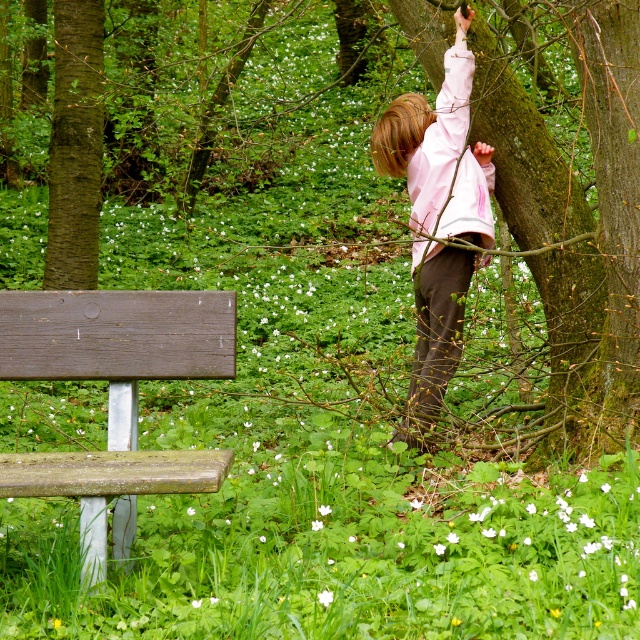
Question: Does wooden bench at lower left have a lesser width compared to pink fabric shirt at upper right?

Choices:
 (A) yes
 (B) no

Answer: (B)

Question: Among these objects, which one is nearest to the camera?

Choices:
 (A) pink fabric shirt at upper right
 (B) wooden bench at lower left

Answer: (B)

Question: Is the position of smooth bark tree at upper right more distant than that of wooden bench at lower left?

Choices:
 (A) yes
 (B) no

Answer: (A)

Question: Which object is farther from the camera taking this photo?

Choices:
 (A) smooth bark tree at upper right
 (B) wooden bench at lower left

Answer: (A)

Question: Does wooden bench at lower left appear on the right side of pink fabric shirt at upper right?

Choices:
 (A) no
 (B) yes

Answer: (A)

Question: Estimate the real-world distances between objects in this image. Which object is closer to the pink fabric shirt at upper right?

Choices:
 (A) wooden bench at lower left
 (B) smooth bark tree at upper right

Answer: (A)